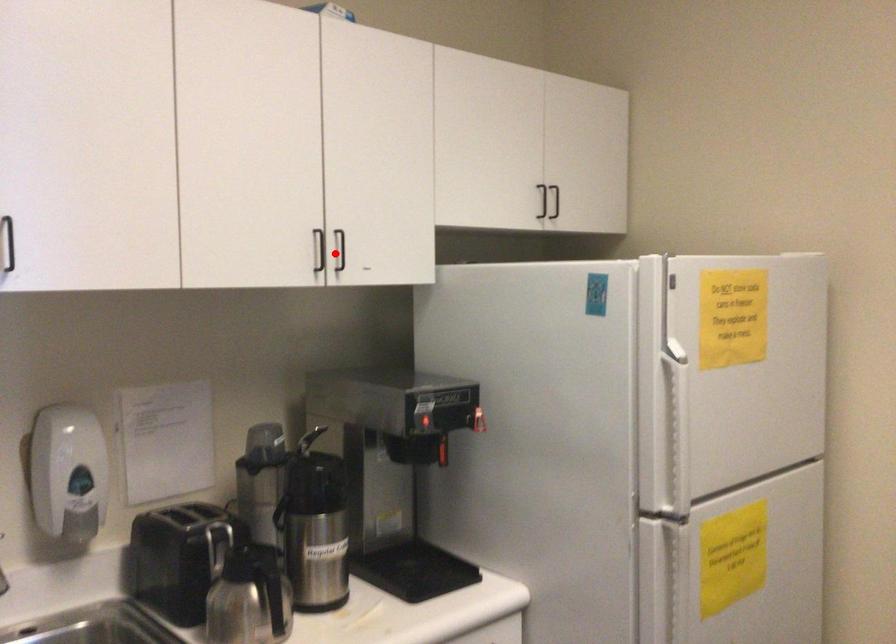
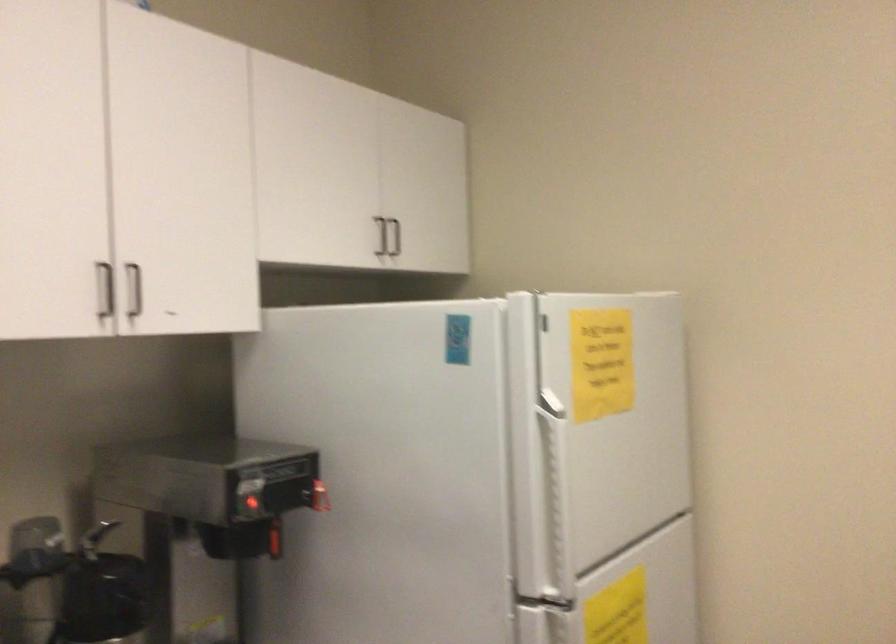
Locate, in the second image, the point that corresponds to the highlighted location in the first image.

(133, 290)